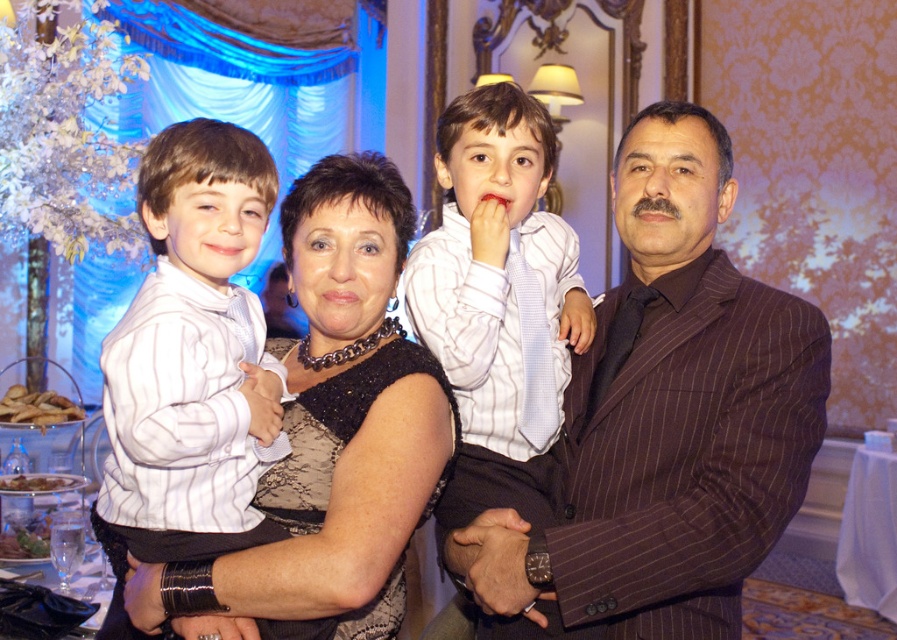
Question: Does white striped shirt at left appear on the left side of white striped shirt at center?

Choices:
 (A) yes
 (B) no

Answer: (A)

Question: Is black lace dress at center above white striped shirt at left?

Choices:
 (A) yes
 (B) no

Answer: (A)

Question: Which point appears closest to the camera in this image?

Choices:
 (A) (x=231, y=148)
 (B) (x=637, y=365)
 (C) (x=556, y=241)
 (D) (x=402, y=244)

Answer: (A)

Question: Among these points, which one is farthest from the camera?

Choices:
 (A) (118, 324)
 (B) (490, 417)
 (C) (345, 433)

Answer: (B)

Question: Is brown pinstripe suit at center wider than white striped shirt at left?

Choices:
 (A) yes
 (B) no

Answer: (A)

Question: Which point appears farthest from the camera in this image?

Choices:
 (A) (475, 392)
 (B) (266, 150)
 (C) (399, 419)
 (D) (793, 500)

Answer: (A)